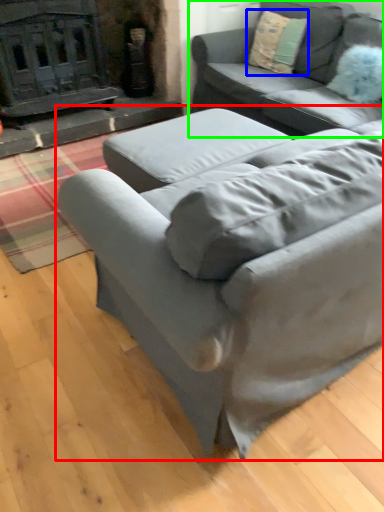
Question: Which is nearer to the studio couch (highlighted by a red box)? throw pillow (highlighted by a blue box) or studio couch (highlighted by a green box).

Choices:
 (A) throw pillow
 (B) studio couch

Answer: (B)